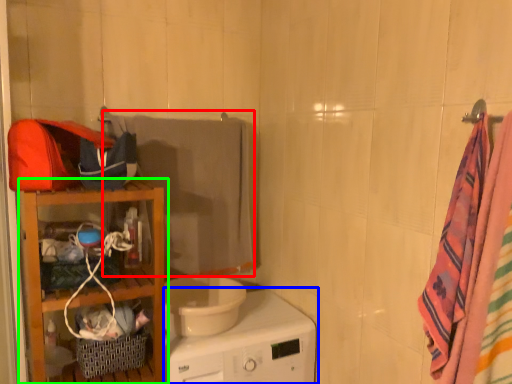
Question: Considering the real-world distances, which object is closest to beach towel (highlighted by a red box)? home appliance (highlighted by a blue box) or furniture (highlighted by a green box).

Choices:
 (A) home appliance
 (B) furniture

Answer: (B)